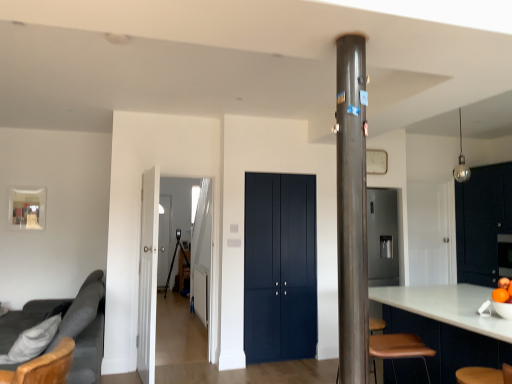
Question: Can you confirm if matte dark blue cabinet at center, which is counted as the second door, starting from the front, is thinner than shiny black dresser at right?

Choices:
 (A) no
 (B) yes

Answer: (B)

Question: Does matte dark blue cabinet at center, which is the 2th door from left to right, have a lesser height compared to shiny black dresser at right?

Choices:
 (A) no
 (B) yes

Answer: (A)

Question: Is the depth of matte dark blue cabinet at center, which is the 2th door from left to right, greater than that of shiny black dresser at right?

Choices:
 (A) no
 (B) yes

Answer: (A)

Question: Does matte dark blue cabinet at center, the first door when ordered from right to left, appear on the right side of shiny black dresser at right?

Choices:
 (A) yes
 (B) no

Answer: (B)

Question: From a real-world perspective, does matte dark blue cabinet at center, the first door when ordered from back to front, sit lower than shiny black dresser at right?

Choices:
 (A) no
 (B) yes

Answer: (B)

Question: Considering their positions, is matte dark blue cabinet at center, the first door when ordered from back to front, located in front of or behind transparent glass door at center, placed as the 1th glass door when sorted from front to back?

Choices:
 (A) front
 (B) behind

Answer: (B)

Question: Considering the positions of matte dark blue cabinet at center, the first door when ordered from back to front, and transparent glass door at center, placed as the 1th glass door when sorted from front to back, in the image, is matte dark blue cabinet at center, the first door when ordered from back to front, bigger or smaller than transparent glass door at center, placed as the 1th glass door when sorted from front to back,?

Choices:
 (A) big
 (B) small

Answer: (B)

Question: Would you say matte dark blue cabinet at center, the first door when ordered from right to left, is to the left or to the right of transparent glass door at center, which appears as the 1th glass door when viewed from the right, in the picture?

Choices:
 (A) left
 (B) right

Answer: (B)

Question: Considering the positions of point (307, 218) and point (147, 375), is point (307, 218) closer or farther from the camera than point (147, 375)?

Choices:
 (A) farther
 (B) closer

Answer: (A)

Question: Is transparent glass door at center, placed as the 1th glass door when sorted from front to back, inside the boundaries of dark gray fabric couch at left, or outside?

Choices:
 (A) inside
 (B) outside

Answer: (B)

Question: From the image's perspective, relative to dark gray fabric couch at left, is transparent glass door at center, placed as the 1th glass door when sorted from front to back, above or below?

Choices:
 (A) below
 (B) above

Answer: (B)

Question: Is transparent glass door at center, which is counted as the 2th glass door, starting from the back, in front of or behind dark gray fabric couch at left in the image?

Choices:
 (A) behind
 (B) front

Answer: (A)

Question: Is transparent glass door at center, which is counted as the 2th glass door, starting from the back, wider or thinner than dark gray fabric couch at left?

Choices:
 (A) wide
 (B) thin

Answer: (B)

Question: Considering their positions, is shiny black dresser at right located in front of or behind metallic gray pole at center?

Choices:
 (A) front
 (B) behind

Answer: (B)

Question: Based on their positions, is shiny black dresser at right located to the left or right of metallic gray pole at center?

Choices:
 (A) left
 (B) right

Answer: (B)